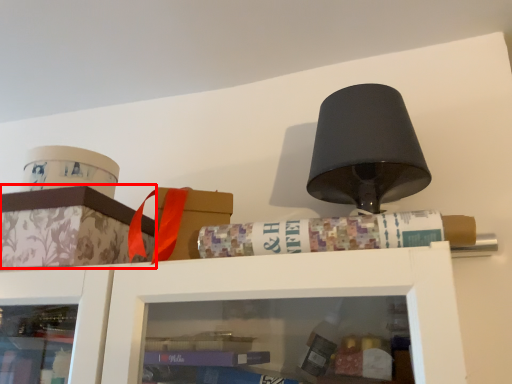
Question: From the image's perspective, considering the relative positions of cabinetry (annotated by the red box) and book in the image provided, where is cabinetry (annotated by the red box) located with respect to the staircase?

Choices:
 (A) above
 (B) below

Answer: (B)